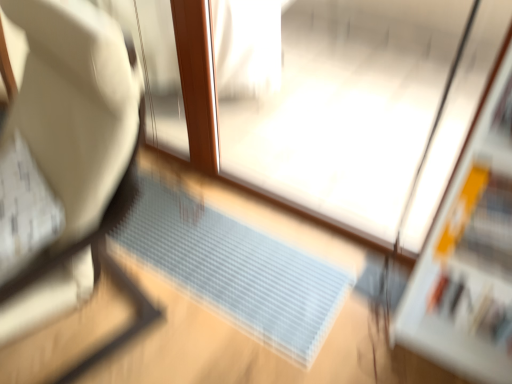
Question: Is translucent plastic doormat at center in front of or behind white fabric chair at left in the image?

Choices:
 (A) behind
 (B) front

Answer: (A)

Question: In terms of size, does translucent plastic doormat at center appear bigger or smaller than white fabric chair at left?

Choices:
 (A) big
 (B) small

Answer: (B)

Question: Which object is positioned closest to the translucent plastic doormat at center?

Choices:
 (A) white fabric chair at left
 (B) transparent plastic screen door at center

Answer: (B)

Question: Estimate the real-world distances between objects in this image. Which object is farther from the translucent plastic doormat at center?

Choices:
 (A) transparent plastic screen door at center
 (B) white fabric chair at left

Answer: (B)